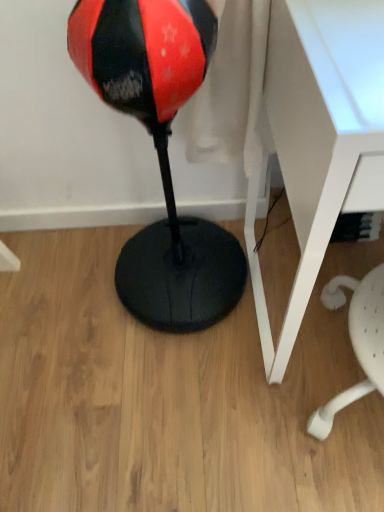
You are a GUI agent. You are given a task and a screenshot of the screen. Output one action in this format:
    pyautogui.click(x=<x>, y=<y>)
    Task: Click on the vacant area that lies in front of red/black glossy bean bag at center
    This screenshot has height=512, width=384.
    Given the screenshot: What is the action you would take?
    pyautogui.click(x=182, y=401)